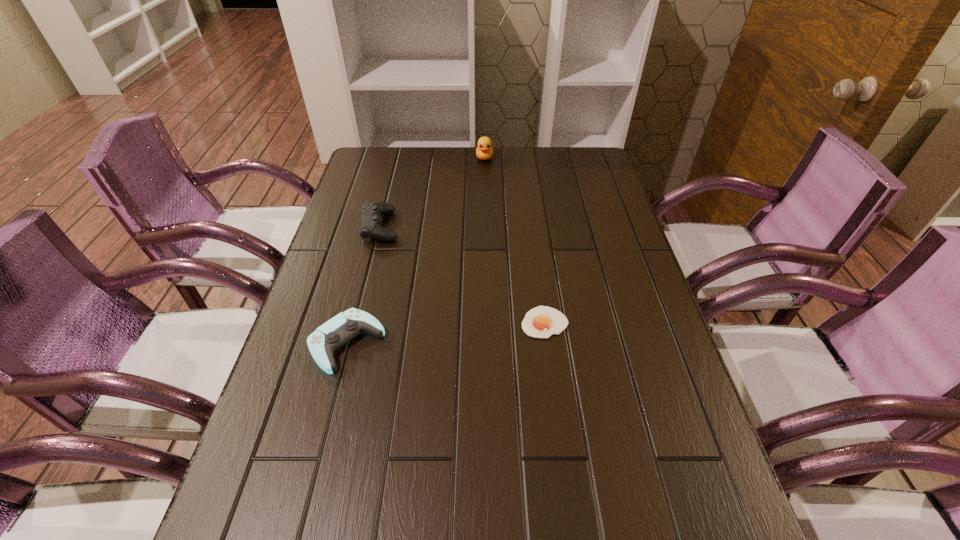
Locate an element on the screen. This screenshot has height=540, width=960. free location that satisfies the following two spatial constraints: 1. on the front side of the shortest object; 2. on the right side of the farther control is located at coordinates (355, 322).

Locate an element on the screen. The width and height of the screenshot is (960, 540). vacant space that satisfies the following two spatial constraints: 1. on the back side of the rightmost object; 2. on the right side of the shorter control is located at coordinates (352, 322).

Where is `vacant point that satisfies the following two spatial constraints: 1. on the face of the shortest object; 2. on the left side of the tallest object`? This screenshot has width=960, height=540. vacant point that satisfies the following two spatial constraints: 1. on the face of the shortest object; 2. on the left side of the tallest object is located at coordinates (487, 322).